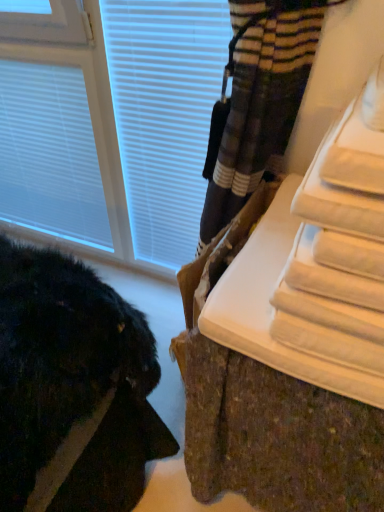
Question: Does point (38, 207) appear closer or farther from the camera than point (297, 323)?

Choices:
 (A) farther
 (B) closer

Answer: (A)

Question: Is white matte blind at upper left spatially inside white textured radiator at lower right, or outside of it?

Choices:
 (A) inside
 (B) outside

Answer: (B)

Question: Estimate the real-world distances between objects in this image. Which object is closer to the white plastic window at upper left?

Choices:
 (A) white matte blind at upper left
 (B) white textured radiator at lower right

Answer: (A)

Question: Which object is positioned farthest from the white matte blind at upper left?

Choices:
 (A) white plastic window at upper left
 (B) white textured radiator at lower right

Answer: (B)